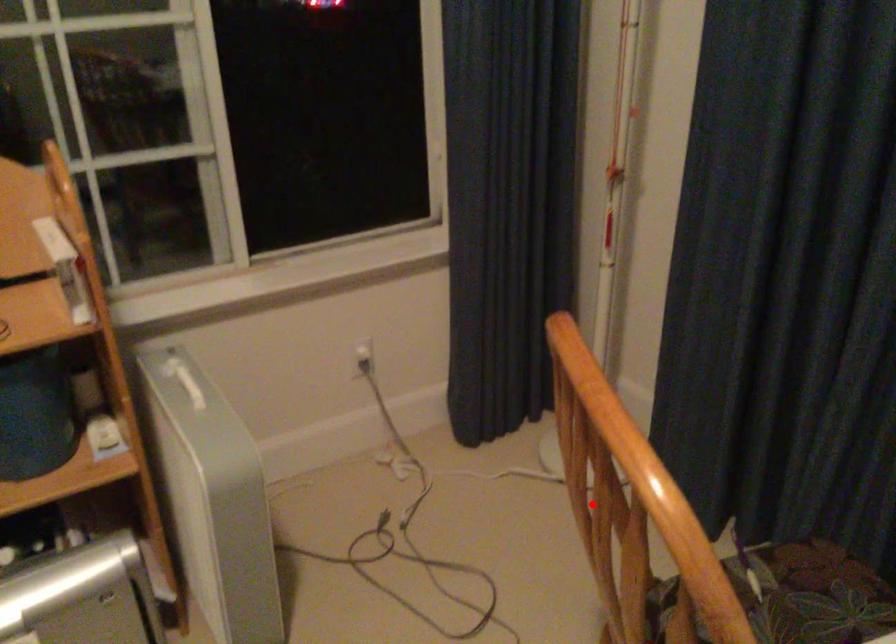
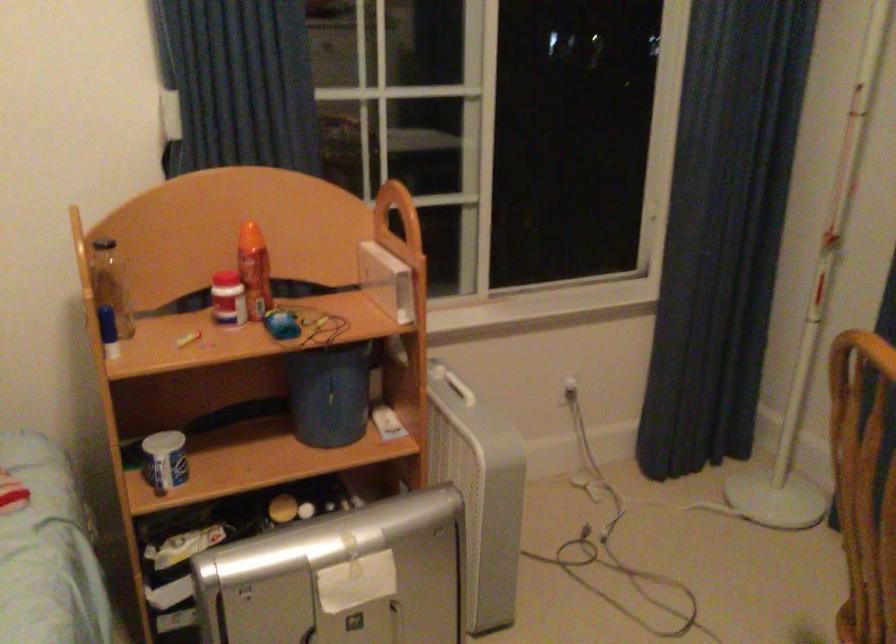
The point at the highlighted location is marked in the first image. Where is the corresponding point in the second image?

(864, 484)